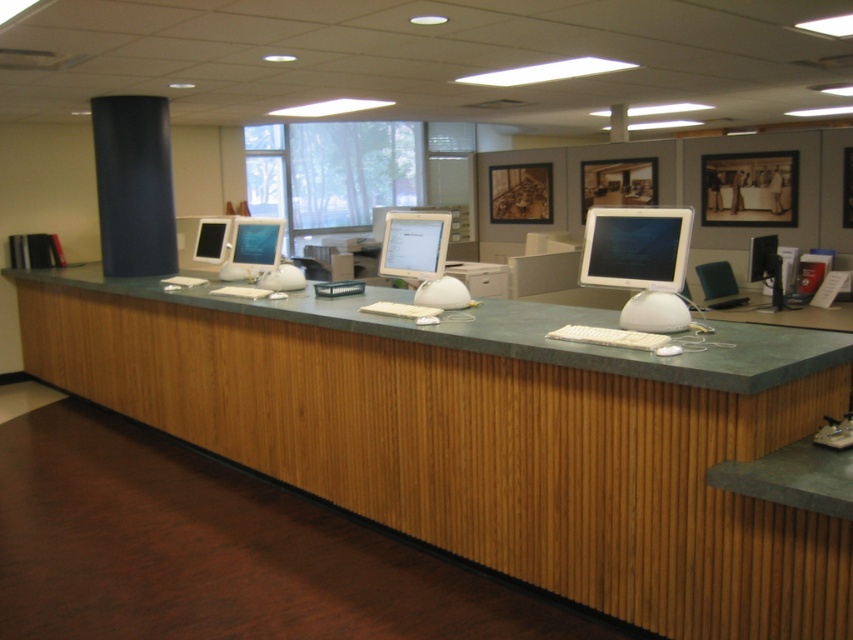
You are an office worker who needs to place a new 20cm wide document holder on the desk. The wooden at center and the matte black monitor at right are already on the desk. Which object should you place the document holder next to to ensure it fits without overlapping?

The wooden at center is wider than the matte black monitor at right, so placing the document holder next to the wooden at center would provide more space to accommodate the 20cm wide document holder without overlapping.

You are standing in the reception area and see the point at coordinates (766, 268). What object is located at that point?

The point at coordinates (766, 268) corresponds to the matte black monitor at right.